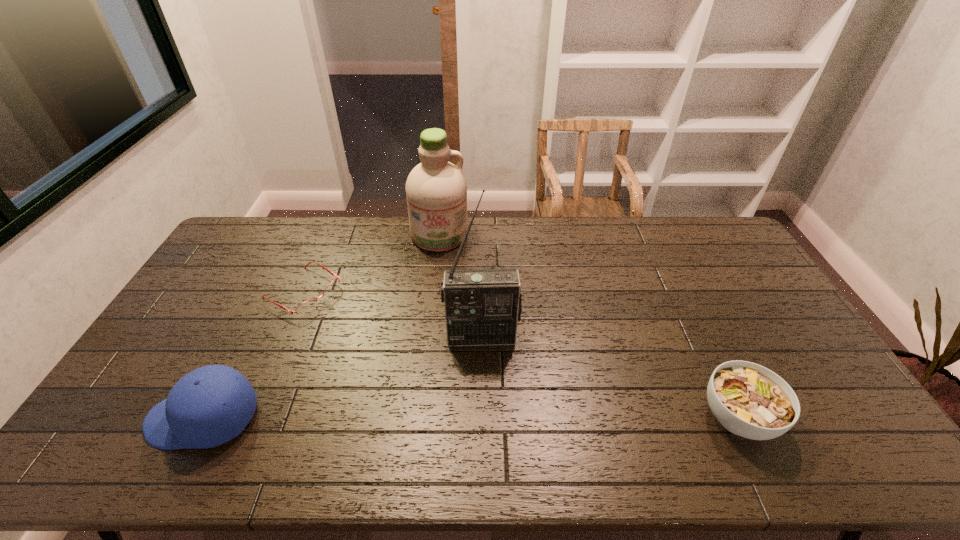
Locate an element on the screen. Image resolution: width=960 pixels, height=540 pixels. vacant region located on the right of the fourth tallest object is located at coordinates (827, 417).

In order to click on free space located 0.190m on the display of the third farthest object in this screenshot , I will do `click(486, 404)`.

Where is `vacant space located on the display of the third farthest object`? Image resolution: width=960 pixels, height=540 pixels. vacant space located on the display of the third farthest object is located at coordinates [x=485, y=382].

I want to click on vacant space located 0.150m on the display of the third farthest object, so click(x=486, y=392).

Where is `vacant space located 0.300m on the front label of the cleansing agent`? This screenshot has height=540, width=960. vacant space located 0.300m on the front label of the cleansing agent is located at coordinates (449, 312).

At what (x,y) coordinates should I click in order to perform the action: click on vacant area situated on the front label of the cleansing agent. Please return your answer as a coordinate pair (x, y). The height and width of the screenshot is (540, 960). Looking at the image, I should click on (451, 328).

Image resolution: width=960 pixels, height=540 pixels. What are the coordinates of `free space located on the front label of the cleansing agent` in the screenshot? It's located at (444, 271).

At what (x,y) coordinates should I click in order to perform the action: click on free spot located 0.260m on the lenses of the shortest object. Please return your answer as a coordinate pair (x, y). The width and height of the screenshot is (960, 540). Looking at the image, I should click on click(389, 342).

Where is `free space located 0.240m on the lenses of the shortest object`? This screenshot has height=540, width=960. free space located 0.240m on the lenses of the shortest object is located at coordinates (384, 339).

Locate an element on the screen. This screenshot has height=540, width=960. vacant position located on the lenses of the shortest object is located at coordinates (365, 328).